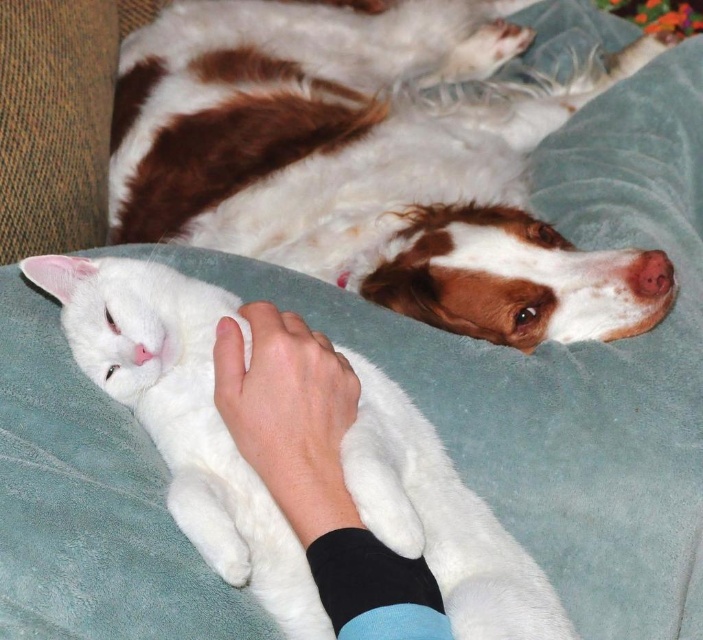
Question: Is black fleece sleeve at lower center thinner than white fur at center?

Choices:
 (A) yes
 (B) no

Answer: (B)

Question: Estimate the real-world distances between objects in this image. Which object is closer to the white fur at center?

Choices:
 (A) white fluffy cat at center
 (B) brown and white fur at upper center

Answer: (A)

Question: Does brown and white fur at upper center come behind black fleece sleeve at lower center?

Choices:
 (A) no
 (B) yes

Answer: (B)

Question: Does black fleece sleeve at lower center appear over white fur at center?

Choices:
 (A) no
 (B) yes

Answer: (A)

Question: Which of the following is the closest to the observer?

Choices:
 (A) white fluffy cat at center
 (B) white fur at center
 (C) brown and white fur at upper center

Answer: (A)

Question: Considering the real-world distances, which object is farthest from the white fur at center?

Choices:
 (A) white fluffy cat at center
 (B) brown and white fur at upper center
 (C) black fleece sleeve at lower center

Answer: (B)